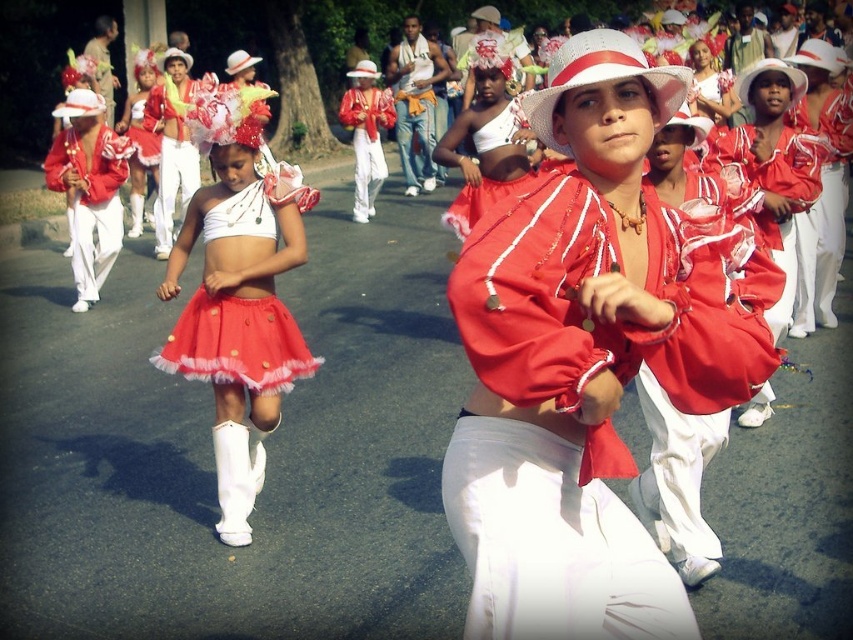
Is white matte hat at center shorter than white fabric hat at upper center?

Yes, white matte hat at center is shorter than white fabric hat at upper center.

Who is lower down, white matte hat at center or white fabric hat at upper center?

white matte hat at center

Is point (606, 29) positioned after point (798, 92)?

No, (606, 29) is closer to viewer.

Image resolution: width=853 pixels, height=640 pixels. In order to click on white matte hat at center in this screenshot , I will do `click(602, 77)`.

Who is lower down, matte red blouse at center or white matte hat at center?

Positioned lower is matte red blouse at center.

Does matte red blouse at center have a larger size compared to white matte hat at center?

Correct, matte red blouse at center is larger in size than white matte hat at center.

I want to click on matte red blouse at center, so click(x=589, y=356).

Is matte red blouse at center wider than matte red skirt at center?

Correct, the width of matte red blouse at center exceeds that of matte red skirt at center.

Is matte red blouse at center bigger than matte red skirt at center?

Correct, matte red blouse at center is larger in size than matte red skirt at center.

This screenshot has width=853, height=640. What are the coordinates of `matte red blouse at center` in the screenshot? It's located at (589, 356).

This screenshot has width=853, height=640. What are the coordinates of `matte red blouse at center` in the screenshot? It's located at (589, 356).